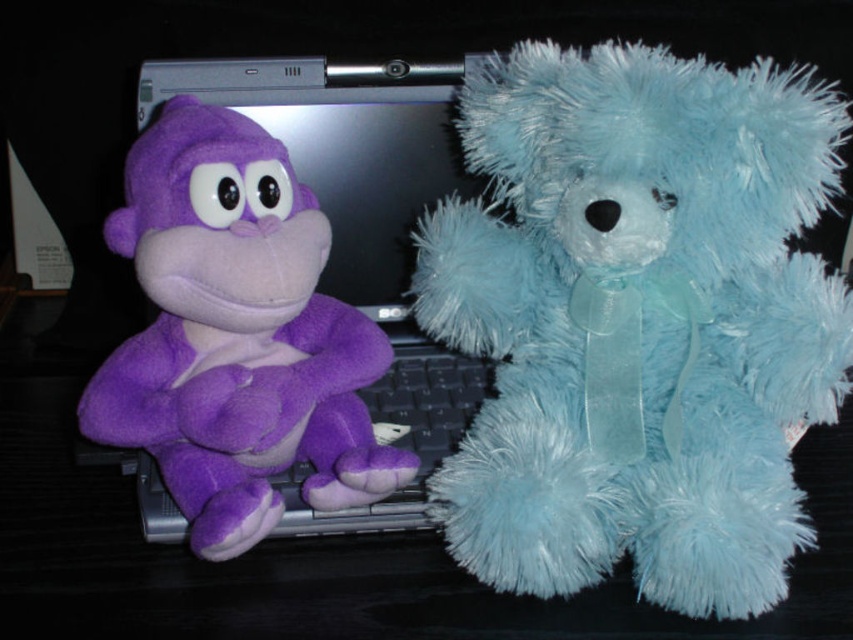
You are setting up a desk for a child. The desk has limited space between the monitor and keyboard. You have a fuzzy light blue teddy bear at right and a purple fabric keyboard at left. Which object takes up more horizontal space on the desk?

The fuzzy light blue teddy bear at right takes up more horizontal space on the desk because its width is larger than the purple fabric keyboard at left.

You are organizing a desk and need to place the purple plush monkey at left and the purple fabric keyboard at left. If the keyboard is already on the desk, can the monkey be placed next to it without overlapping?

The purple plush monkey at left is larger in size than the purple fabric keyboard at left, so there might not be enough space to place them next to each other without overlapping. Check the available desk space before placing.

You are trying to place a new toy between the two points, point [526,182] and point [248,506]. Since you want it to be in front of the purple stuffed monkey, which point should you place it closer to?

To place the new toy in front of the purple stuffed monkey, you should place it closer to point [248,506] because point [526,182] is behind point [248,506].